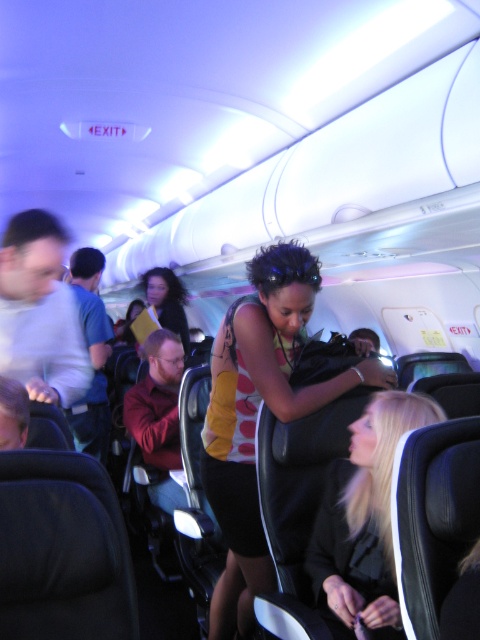
Between blue fabric shirt at left and matte yellow jacket at center, which one appears on the right side from the viewer's perspective?

matte yellow jacket at center

Does blue fabric shirt at left appear over matte yellow jacket at center?

Actually, blue fabric shirt at left is below matte yellow jacket at center.

Which is behind, point (96, 253) or point (184, 340)?

Positioned behind is point (184, 340).

At what (x,y) coordinates should I click in order to perform the action: click on blue fabric shirt at left. Please return your answer as a coordinate pair (x, y). Looking at the image, I should click on (92, 355).

Does yellow sleeveless top at center appear on the left side of black leather jacket at lower right?

Correct, you'll find yellow sleeveless top at center to the left of black leather jacket at lower right.

Between yellow sleeveless top at center and black leather jacket at lower right, which one is positioned higher?

Positioned higher is yellow sleeveless top at center.

Is point (268, 276) less distant than point (380, 532)?

No, (268, 276) is behind (380, 532).

You are a GUI agent. You are given a task and a screenshot of the screen. Output one action in this format:
    pyautogui.click(x=<x>, y=<y>)
    Task: Click on the yellow sleeveless top at center
    
    Given the screenshot: What is the action you would take?
    pyautogui.click(x=256, y=413)

Can you confirm if yellow sleeveless top at center is positioned below matte yellow jacket at center?

Yes, yellow sleeveless top at center is below matte yellow jacket at center.

Is point (239, 344) closer to viewer compared to point (149, 284)?

Yes.

What do you see at coordinates (256, 413) in the screenshot? I see `yellow sleeveless top at center` at bounding box center [256, 413].

In order to click on yellow sleeveless top at center in this screenshot , I will do [x=256, y=413].